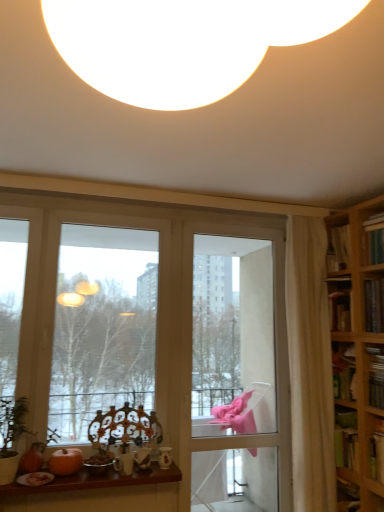
Measure the distance between hardcover book at right, the 1th book when ordered from bottom to top, and camera.

A distance of 7.82 feet exists between hardcover book at right, the 1th book when ordered from bottom to top, and camera.

Locate an element on the screen. transparent glass window at center is located at coordinates (157, 309).

What do you see at coordinates (98, 492) in the screenshot?
I see `wooden table at lower center` at bounding box center [98, 492].

Where is `white sheer curtain at right`? This screenshot has height=512, width=384. white sheer curtain at right is located at coordinates (310, 365).

Locate an element on the screen. hardcover book at right, the 1th book when ordered from bottom to top is located at coordinates (376, 375).

From the picture: From a real-world perspective, between hardcover book at right, which ranks as the 2th book in top-to-bottom order, and hardcover book at right, marked as the third book in a top-to-bottom arrangement, who is vertically lower?

hardcover book at right, marked as the third book in a top-to-bottom arrangement, is physically lower.

Starting from the hardcover book at right, which ranks as the 2th book in top-to-bottom order, which book is the 1st one behind? Please provide its 2D coordinates.

[(376, 375)]

Is hardcover book at right, which ranks as the 2th book in top-to-bottom order, turned away from hardcover book at right, the 1th book when ordered from bottom to top?

No.

Consider the image. Who is bigger, hardcover book at right, which appears as the 2th book when ordered from the bottom, or hardcover book at right, the 1th book when ordered from bottom to top?

With larger size is hardcover book at right, which appears as the 2th book when ordered from the bottom.

Considering the positions of objects white sheer curtain at right and transparent glass window at center in the image provided, who is behind, white sheer curtain at right or transparent glass window at center?

white sheer curtain at right is further from the camera.

Which is further, [297,279] or [172,506]?

The point [297,279] is farther.

Who is taller, white sheer curtain at right or transparent glass window at center?

white sheer curtain at right.

The height and width of the screenshot is (512, 384). Identify the location of the 1st book above the white sheer curtain at right (from a real-world perspective). (374, 305).

Is hardcover book at right, which ranks as the 2th book in top-to-bottom order, facing towards white sheer curtain at right?

No, hardcover book at right, which ranks as the 2th book in top-to-bottom order, is not turned towards white sheer curtain at right.

Could you measure the distance between hardcover book at right, which ranks as the 2th book in top-to-bottom order, and white sheer curtain at right?

They are 18.83 inches apart.

Is point (383, 281) farther from viewer compared to point (321, 418)?

No, (383, 281) is closer to viewer.

From a real-world perspective, which book is the 3rd one above the wooden table at lower center? Please provide its 2D coordinates.

[(374, 220)]

Which is in front, hardcover book at upper right, acting as the third book starting from the bottom, or wooden table at lower center?

wooden table at lower center.

Considering the points (380, 222) and (116, 473), which point is behind, point (380, 222) or point (116, 473)?

The point (380, 222) is more distant.

Is hardcover book at upper right, the first book in the top-to-bottom sequence, at the right side of wooden table at lower center?

Correct, you'll find hardcover book at upper right, the first book in the top-to-bottom sequence, to the right of wooden table at lower center.

From the image's perspective, is transparent glass window at center below hardcover book at right, marked as the third book in a top-to-bottom arrangement?

No.

Measure the distance from transparent glass window at center to hardcover book at right, the 1th book when ordered from bottom to top.

They are 4.04 feet apart.

Is the surface of transparent glass window at center in direct contact with hardcover book at right, the 1th book when ordered from bottom to top?

No, transparent glass window at center is not in contact with hardcover book at right, the 1th book when ordered from bottom to top.

From a real-world perspective, which object stands above the other?

transparent glass window at center, from a real-world perspective.

Looking at this image, is transparent glass window at center looking in the opposite direction of hardcover book at right, which appears as the 2th book when ordered from the bottom?

transparent glass window at center does not have its back to hardcover book at right, which appears as the 2th book when ordered from the bottom.

What's the angular difference between transparent glass window at center and hardcover book at right, which appears as the 2th book when ordered from the bottom,'s facing directions?

The angular difference between transparent glass window at center and hardcover book at right, which appears as the 2th book when ordered from the bottom, is 89.6 degrees.

Between transparent glass window at center and hardcover book at right, which ranks as the 2th book in top-to-bottom order, which one has less height?

Standing shorter between the two is hardcover book at right, which ranks as the 2th book in top-to-bottom order.

This screenshot has width=384, height=512. I want to click on the 2nd book to the right of the transparent glass window at center, counting from the anchor's position, so click(374, 305).

From the image's perspective, is white sheer curtain at right below hardcover book at right, which appears as the 2th book when ordered from the bottom?

Correct, white sheer curtain at right appears lower than hardcover book at right, which appears as the 2th book when ordered from the bottom, in the image.

Is white sheer curtain at right wider or thinner than hardcover book at right, which ranks as the 2th book in top-to-bottom order?

In the image, white sheer curtain at right appears to be more narrow than hardcover book at right, which ranks as the 2th book in top-to-bottom order.

Does white sheer curtain at right appear on the left side of hardcover book at right, which appears as the 2th book when ordered from the bottom?

Indeed, white sheer curtain at right is positioned on the left side of hardcover book at right, which appears as the 2th book when ordered from the bottom.

Considering the relative sizes of white sheer curtain at right and hardcover book at right, which ranks as the 2th book in top-to-bottom order, in the image provided, is white sheer curtain at right shorter than hardcover book at right, which ranks as the 2th book in top-to-bottom order,?

No.

Starting from the hardcover book at right, the 1th book when ordered from bottom to top, which book is the 1st one to the right? Please provide its 2D coordinates.

[(374, 305)]

In the image, there is a transparent glass window at center. In order to click on curtain below it (from the image's perspective) in this screenshot , I will do `click(310, 365)`.

Which object lies further to the anchor point hardcover book at right, which ranks as the 2th book in top-to-bottom order, orange matte pumpkin at lower left or transparent glass window at center?

The object further to hardcover book at right, which ranks as the 2th book in top-to-bottom order, is orange matte pumpkin at lower left.

Estimate the real-world distances between objects in this image. Which object is further from white sheer curtain at right, clear glass screen door at center or hardcover book at right, marked as the third book in a top-to-bottom arrangement?

clear glass screen door at center lies further to white sheer curtain at right than the other object.

From the picture: Considering their positions, is clear glass screen door at center positioned further to hardcover book at right, which ranks as the 2th book in top-to-bottom order, than hardcover book at upper right, acting as the third book starting from the bottom?

clear glass screen door at center is further to hardcover book at right, which ranks as the 2th book in top-to-bottom order.

Looking at the image, which one is located closer to orange matte pumpkin at lower left, white sheer curtain at right or hardcover book at right, which appears as the 2th book when ordered from the bottom?

white sheer curtain at right is positioned closer to the anchor orange matte pumpkin at lower left.

Which object lies nearer to the anchor point hardcover book at upper right, the first book in the top-to-bottom sequence, clear glass screen door at center or white sheer curtain at right?

Based on the image, white sheer curtain at right appears to be nearer to hardcover book at upper right, the first book in the top-to-bottom sequence.

Based on their spatial positions, is wooden table at lower center or hardcover book at right, the 1th book when ordered from bottom to top, further from orange matte pumpkin at lower left?

hardcover book at right, the 1th book when ordered from bottom to top, is positioned further to the anchor orange matte pumpkin at lower left.

Looking at the image, which one is located further to clear glass screen door at center, hardcover book at right, the 1th book when ordered from bottom to top, or hardcover book at upper right, acting as the third book starting from the bottom?

Based on the image, hardcover book at upper right, acting as the third book starting from the bottom, appears to be further to clear glass screen door at center.

From the image, which object appears to be farther from hardcover book at right, the 1th book when ordered from bottom to top, hardcover book at right, which ranks as the 2th book in top-to-bottom order, or white sheer curtain at right?

The object further to hardcover book at right, the 1th book when ordered from bottom to top, is white sheer curtain at right.

Find the location of a particular element. table located between transparent glass window at center and hardcover book at upper right, acting as the third book starting from the bottom, in the left-right direction is located at coordinates (98, 492).

The image size is (384, 512). What are the coordinates of `table between transparent glass window at center and hardcover book at right, which appears as the 2th book when ordered from the bottom` in the screenshot? It's located at (98, 492).

Locate an element on the screen. curtain between hardcover book at upper right, acting as the third book starting from the bottom, and clear glass screen door at center in the up-down direction is located at coordinates (310, 365).

This screenshot has height=512, width=384. What are the coordinates of `screen door located between wooden table at lower center and hardcover book at right, the 1th book when ordered from bottom to top, in the left-right direction` in the screenshot? It's located at (240, 370).